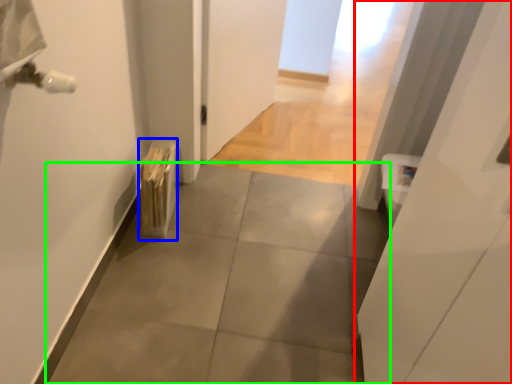
Question: Estimate the real-world distances between objects in this image. Which object is closer to door (highlighted by a red box), radiator (highlighted by a blue box) or concrete (highlighted by a green box)?

Choices:
 (A) radiator
 (B) concrete

Answer: (B)